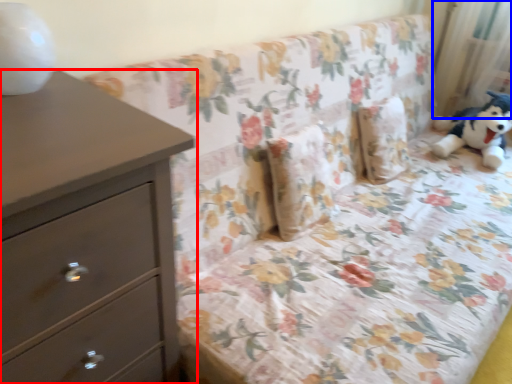
Question: Among these objects, which one is nearest to the camera, chest of drawers (highlighted by a red box) or curtain (highlighted by a blue box)?

Choices:
 (A) chest of drawers
 (B) curtain

Answer: (A)